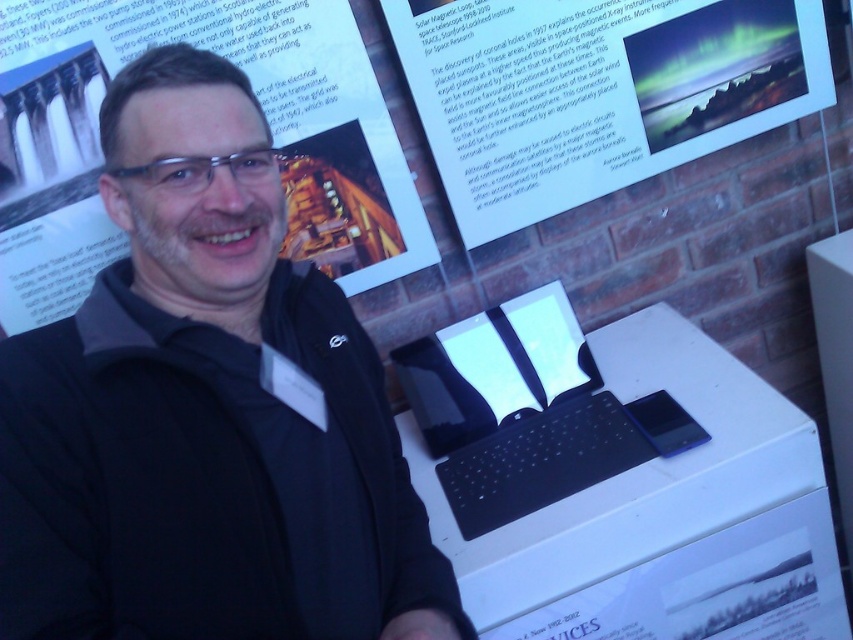
Does black matte jacket at center appear on the right side of white paper poster at upper center?

Indeed, black matte jacket at center is positioned on the right side of white paper poster at upper center.

Does black matte jacket at center have a lesser width compared to white paper poster at upper center?

Indeed, black matte jacket at center has a lesser width compared to white paper poster at upper center.

I want to click on black matte jacket at center, so click(206, 410).

At what (x,y) coordinates should I click in order to perform the action: click on black matte jacket at center. Please return your answer as a coordinate pair (x, y). Looking at the image, I should click on (206, 410).

Is black matte jacket at center behind white paper at upper center?

No, it is in front of white paper at upper center.

Between point (148, 250) and point (764, 99), which one is positioned behind?

Positioned behind is point (764, 99).

You are a GUI agent. You are given a task and a screenshot of the screen. Output one action in this format:
    pyautogui.click(x=<x>, y=<y>)
    Task: Click on the black matte jacket at center
    
    Given the screenshot: What is the action you would take?
    pyautogui.click(x=206, y=410)

Where is `black matte jacket at center`? This screenshot has width=853, height=640. black matte jacket at center is located at coordinates (206, 410).

Consider the image. Who is shorter, black matte jacket at center or black glossy laptop at center?

Standing shorter between the two is black glossy laptop at center.

Between point (386, 524) and point (534, 422), which one is positioned behind?

The point (534, 422) is behind.

Which is behind, point (270, 172) or point (492, 353)?

Positioned behind is point (492, 353).

Identify the location of black matte jacket at center. The height and width of the screenshot is (640, 853). (206, 410).